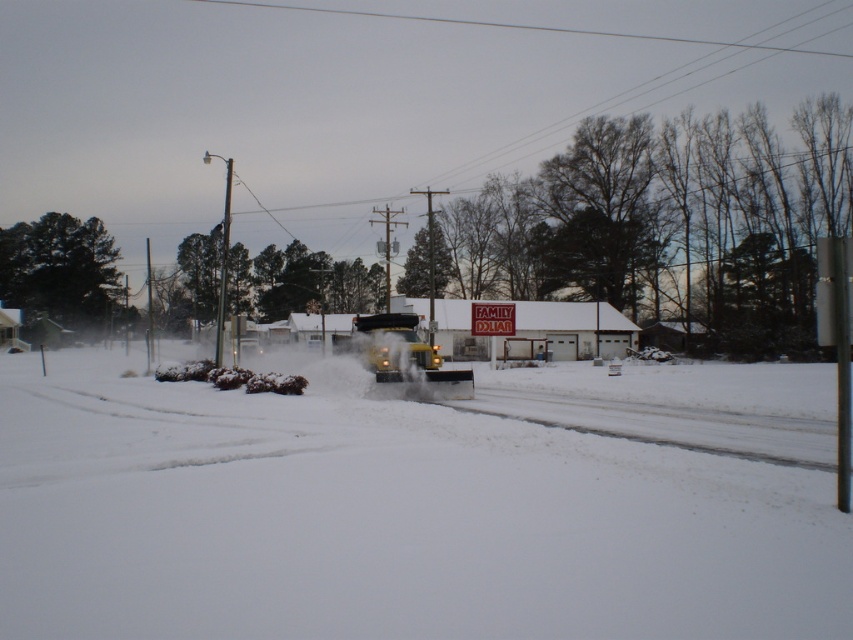
You are standing at the origin point of the image. Which direction should you walk to reach the white powdery snow at center?

The white powdery snow at center is located at coordinates point (383, 518), so you should walk towards the direction of the point (383, 518) to reach it.